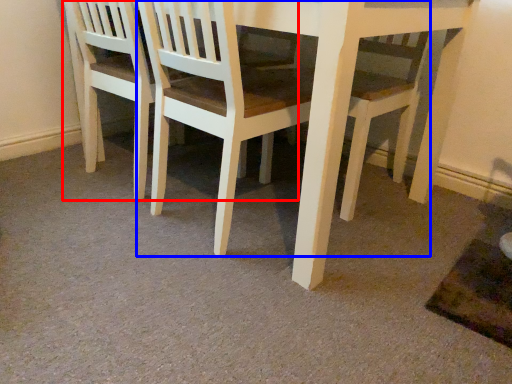
Question: Which object is further to the camera taking this photo, chair (highlighted by a red box) or chair (highlighted by a blue box)?

Choices:
 (A) chair
 (B) chair

Answer: (A)